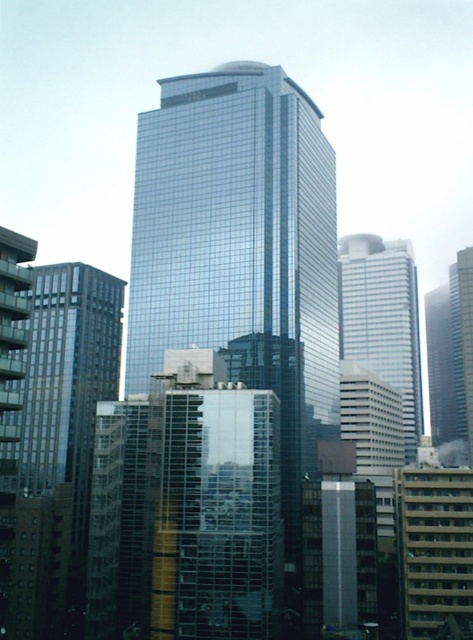
You are an urban planner evaluating the skyline of this city. You notice the shiny glass skyscraper at center and the white glass building at center. Which of these two buildings is smaller in size?

The shiny glass skyscraper at center has a smaller size compared to the white glass building at center, so the shiny glass skyscraper at center is the smaller one.

You are an urban planner assessing the skyline. You need to determine which of the two buildings, the beige concrete building at lower right or the white glass building at center, would require more space for construction. Based on their sizes, which one would need a larger plot of land?

The white glass building at center requires a larger plot of land because it is bigger than the beige concrete building at lower right.

You are a drone operator trying to capture aerial footage of the shiny glass skyscraper at center and the beige concrete building at lower right. If you want to ensure both buildings are fully visible in the frame, which building should you position closer to the camera?

You should position the beige concrete building at lower right closer to the camera because it is shorter than the shiny glass skyscraper at center, so placing it nearer will help balance their sizes in the frame.